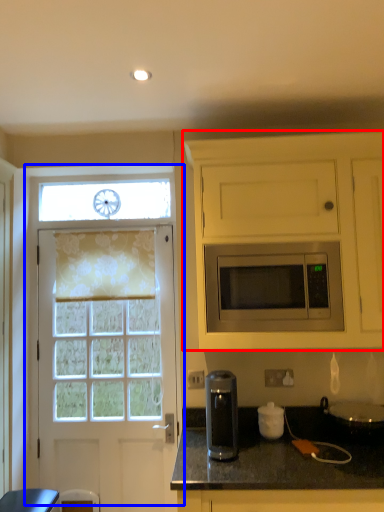
Question: Which object appears closest to the camera in this image, cabinetry (highlighted by a red box) or door (highlighted by a blue box)?

Choices:
 (A) cabinetry
 (B) door

Answer: (A)